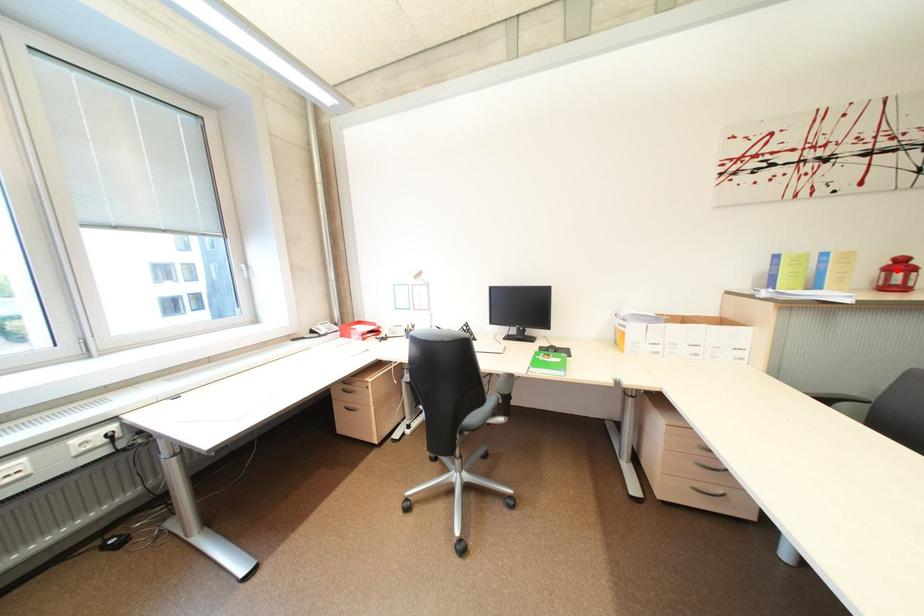
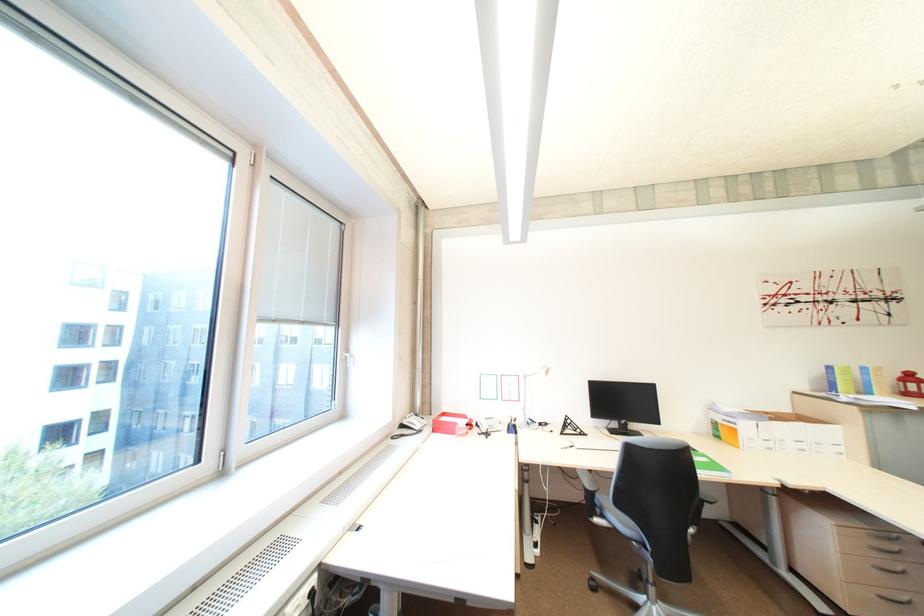
Question: I am providing you with two images of the same scene from different viewpoints. Given a red point in image1, look at the same physical point in image2. Is it:

Choices:
 (A) Closer to the viewpoint
 (B) Farther from the viewpoint

Answer: (A)